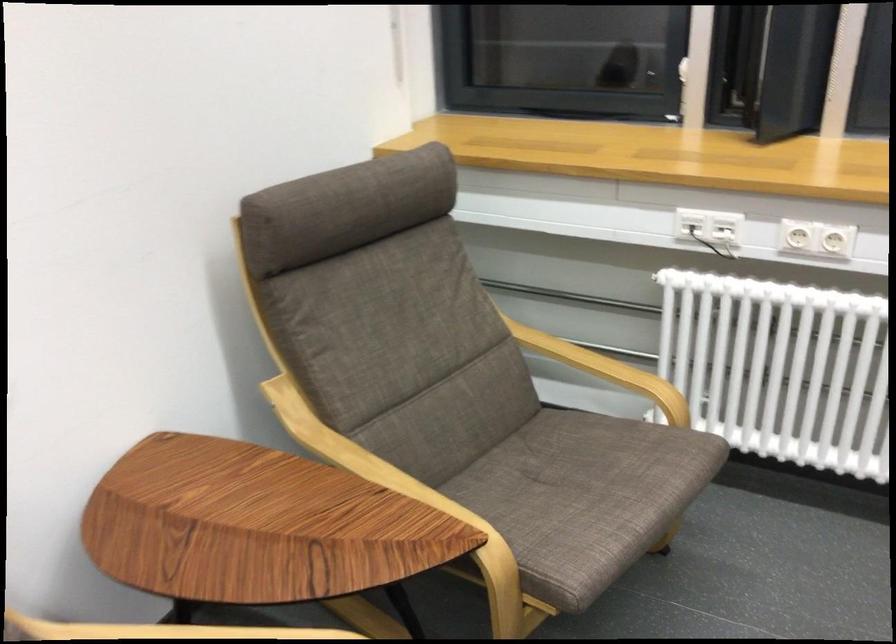
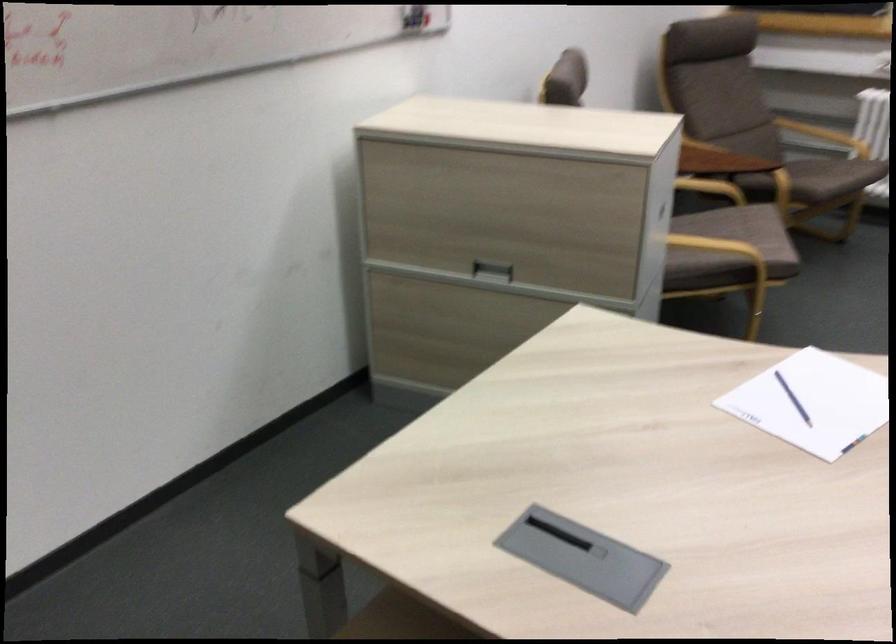
Locate, in the second image, the point that corresponds to the point at 580,354 in the first image.

(824, 136)